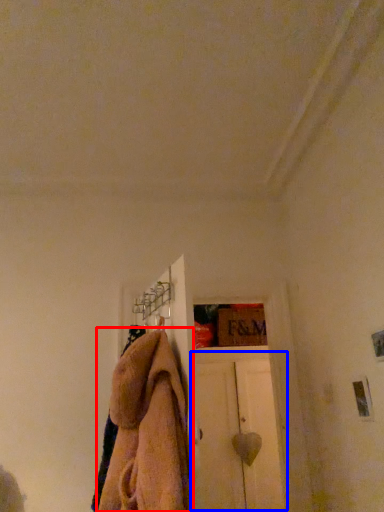
Question: Which point is closer to the camera, towel (highlighted by a red box) or door (highlighted by a blue box)?

Choices:
 (A) towel
 (B) door

Answer: (A)